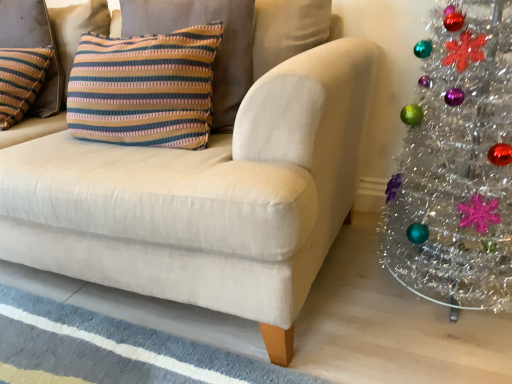
Question: Can you confirm if striped fabric pillow at upper left, which is the first pillow in right-to-left order, is wider than matte beige couch at center?

Choices:
 (A) yes
 (B) no

Answer: (B)

Question: From a real-world perspective, is striped fabric pillow at upper left, which is the 2th pillow in left-to-right order, physically above matte beige couch at center?

Choices:
 (A) no
 (B) yes

Answer: (B)

Question: Does striped fabric pillow at upper left, which is the first pillow in right-to-left order, have a larger size compared to matte beige couch at center?

Choices:
 (A) yes
 (B) no

Answer: (B)

Question: Is striped fabric pillow at upper left, which is the 2th pillow in left-to-right order, to the right of matte beige couch at center from the viewer's perspective?

Choices:
 (A) yes
 (B) no

Answer: (A)

Question: Is striped fabric pillow at upper left, which is the first pillow in right-to-left order, far away from matte beige couch at center?

Choices:
 (A) no
 (B) yes

Answer: (A)

Question: Does striped fabric pillow at upper left, which is the 2th pillow in left-to-right order, turn towards matte beige couch at center?

Choices:
 (A) yes
 (B) no

Answer: (A)

Question: From the image's perspective, does striped fabric pillow at upper left, which is the 2th pillow in left-to-right order, appear higher than shiny silver christmas tree at right?

Choices:
 (A) no
 (B) yes

Answer: (B)

Question: Is striped fabric pillow at upper left, which is the first pillow in right-to-left order, outside shiny silver christmas tree at right?

Choices:
 (A) no
 (B) yes

Answer: (B)

Question: Does striped fabric pillow at upper left, which is the first pillow in right-to-left order, have a greater width compared to shiny silver christmas tree at right?

Choices:
 (A) no
 (B) yes

Answer: (A)

Question: Does striped fabric pillow at upper left, which is the first pillow in right-to-left order, have a lesser height compared to shiny silver christmas tree at right?

Choices:
 (A) no
 (B) yes

Answer: (B)

Question: Does striped fabric pillow at upper left, which is the 2th pillow in left-to-right order, have a greater height compared to shiny silver christmas tree at right?

Choices:
 (A) yes
 (B) no

Answer: (B)

Question: Is striped fabric pillow at upper left, which is the first pillow in right-to-left order, to the left of shiny silver christmas tree at right from the viewer's perspective?

Choices:
 (A) yes
 (B) no

Answer: (A)

Question: Can you confirm if matte beige couch at center is positioned to the left of striped fabric pillow at upper left, which is the 2th pillow in left-to-right order?

Choices:
 (A) yes
 (B) no

Answer: (A)